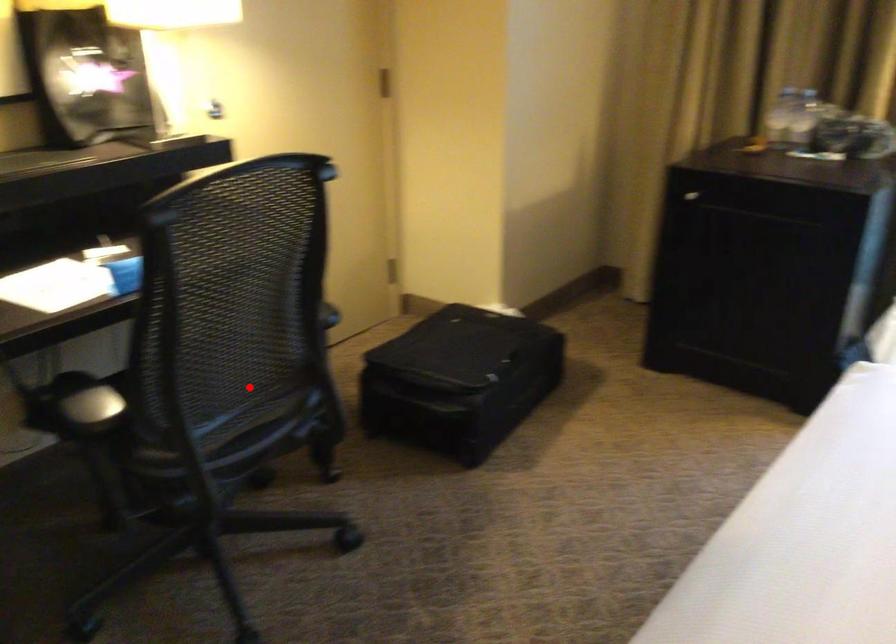
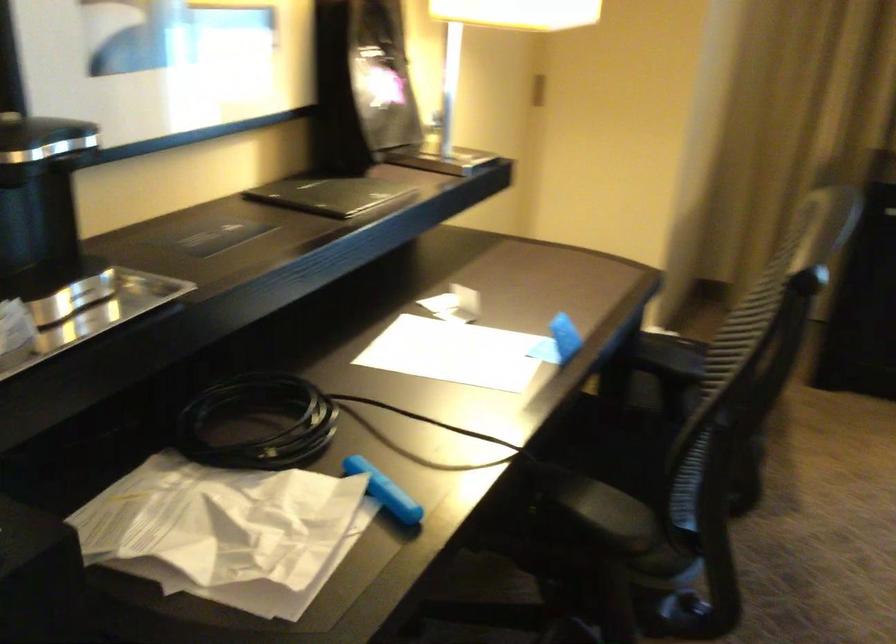
The point at the highlighted location is marked in the first image. Where is the corresponding point in the second image?

(625, 457)